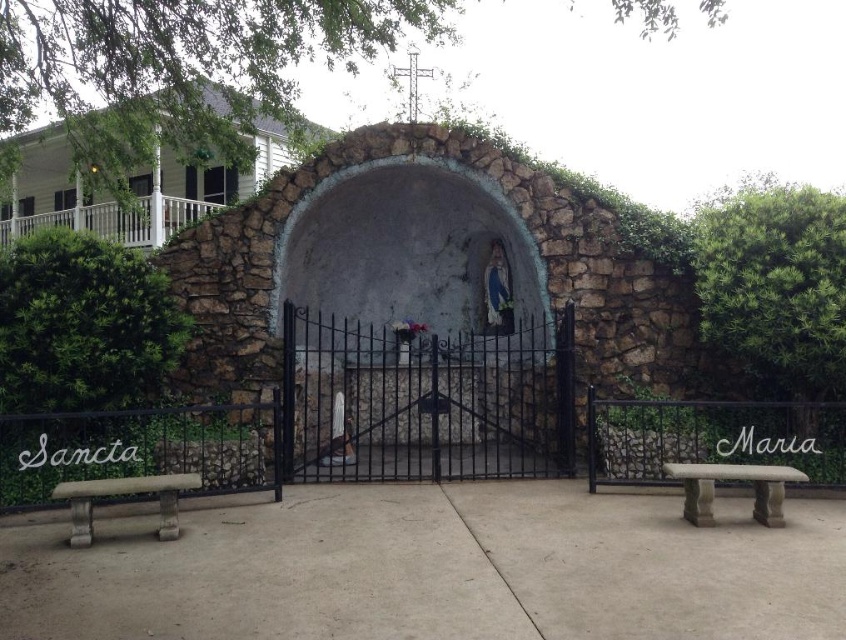
You are a visitor approaching the shrine and want to sit down. You see the stone wall at upper left and the stone bench at lower left. Which one can you sit on?

The stone bench at lower left is the one you can sit on because it is larger than the stone wall at upper left, which is too small for sitting.

You are a visitor at the shrine and want to sit on the stone benches. How far apart are the stone bench at lower right and the stone bench at lower left?

The stone bench at lower right is 4.02 meters from the stone bench at lower left.

In the scene shown: You are standing in front of the shrine and want to place a 2.5 meter long ladder between the stone wall at upper left and the stone bench at lower left. Is there enough space for the ladder?

The distance between the stone wall at upper left and the stone bench at lower left is 6.96 meters, so the ladder of 2.5 meters can be placed there as there is sufficient space.